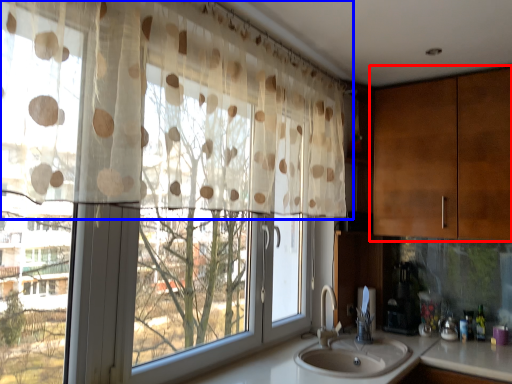
Question: Among these objects, which one is nearest to the camera, cabinetry (highlighted by a red box) or curtain (highlighted by a blue box)?

Choices:
 (A) cabinetry
 (B) curtain

Answer: (B)